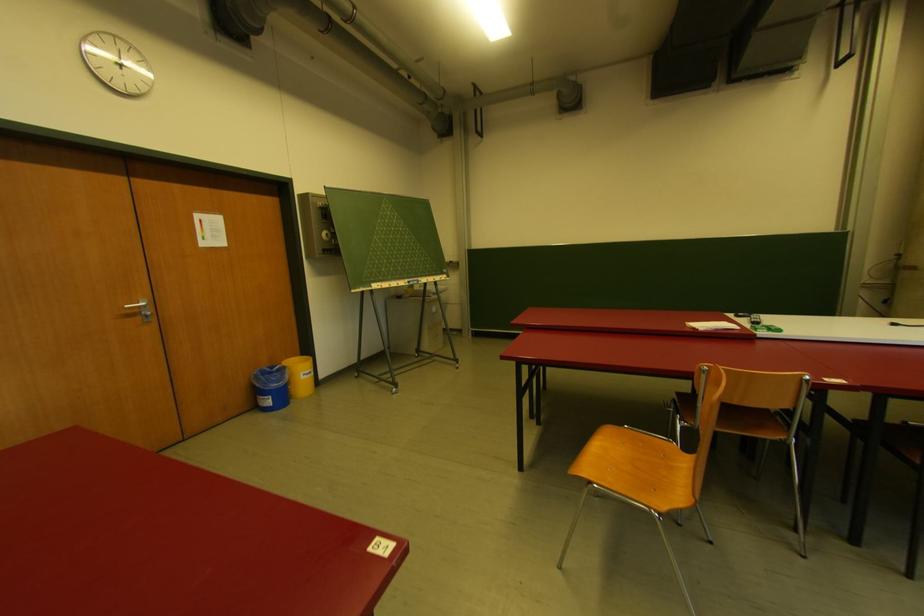
Describe the element at coordinates (329, 240) in the screenshot. I see `the grey control knob` at that location.